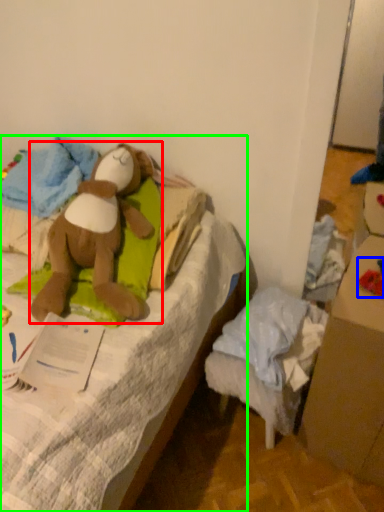
Question: Estimate the real-world distances between objects in this image. Which object is closer to toy (highlighted by a red box), toy (highlighted by a blue box) or furniture (highlighted by a green box)?

Choices:
 (A) toy
 (B) furniture

Answer: (B)